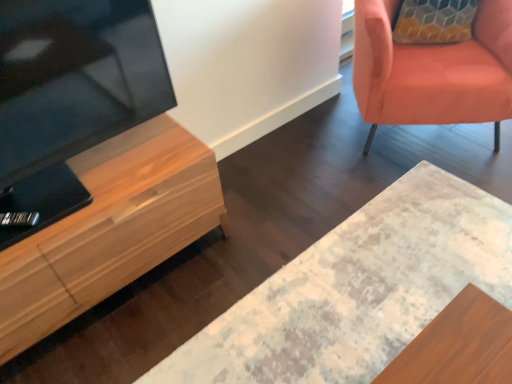
The height and width of the screenshot is (384, 512). I want to click on free spot below distressed wood desk at center (from a real-world perspective), so point(373,284).